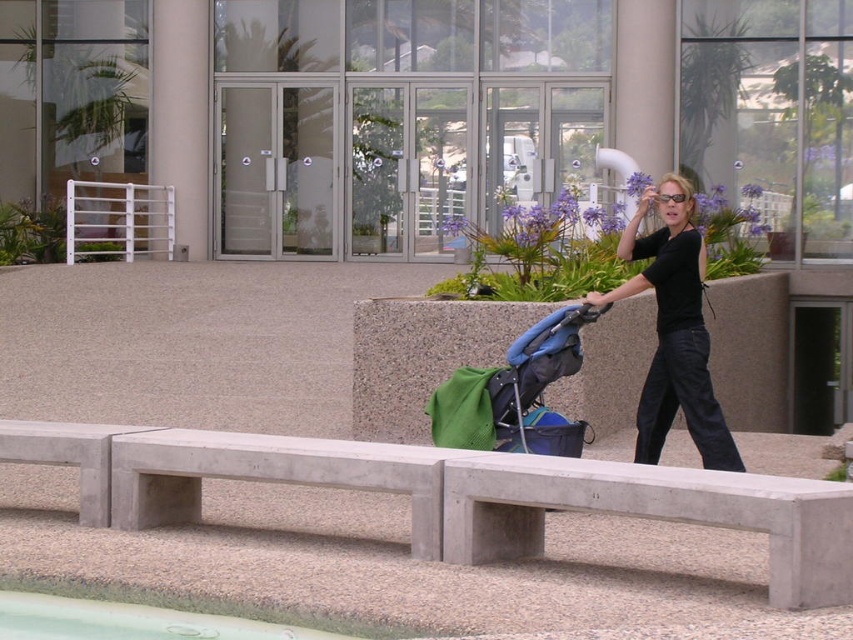
Which of these two, black matte shirt at center or white metal rail at upper left, stands taller?

black matte shirt at center

Does point (688, 340) come behind point (141, 243)?

No, it is not.

This screenshot has width=853, height=640. In order to click on black matte shirt at center in this screenshot , I will do `click(672, 330)`.

Describe the element at coordinates (451, 493) in the screenshot. I see `concrete bench at lower center` at that location.

Can you confirm if concrete bench at lower center is taller than blue fabric stroller at center?

Incorrect, concrete bench at lower center's height is not larger of blue fabric stroller at center's.

Is point (15, 436) farther from camera compared to point (517, 337)?

No, it is in front of (517, 337).

The height and width of the screenshot is (640, 853). In order to click on concrete bench at lower center in this screenshot , I will do `click(451, 493)`.

Consider the image. Is concrete bench at lower center positioned at the back of black matte shirt at center?

No, it is in front of black matte shirt at center.

Between point (785, 540) and point (682, 337), which one is positioned in front?

Point (785, 540) is more forward.

Is point (425, 518) farther from camera compared to point (665, 406)?

No.

At what (x,y) coordinates should I click in order to perform the action: click on concrete bench at lower center. Please return your answer as a coordinate pair (x, y). This screenshot has width=853, height=640. Looking at the image, I should click on (451, 493).